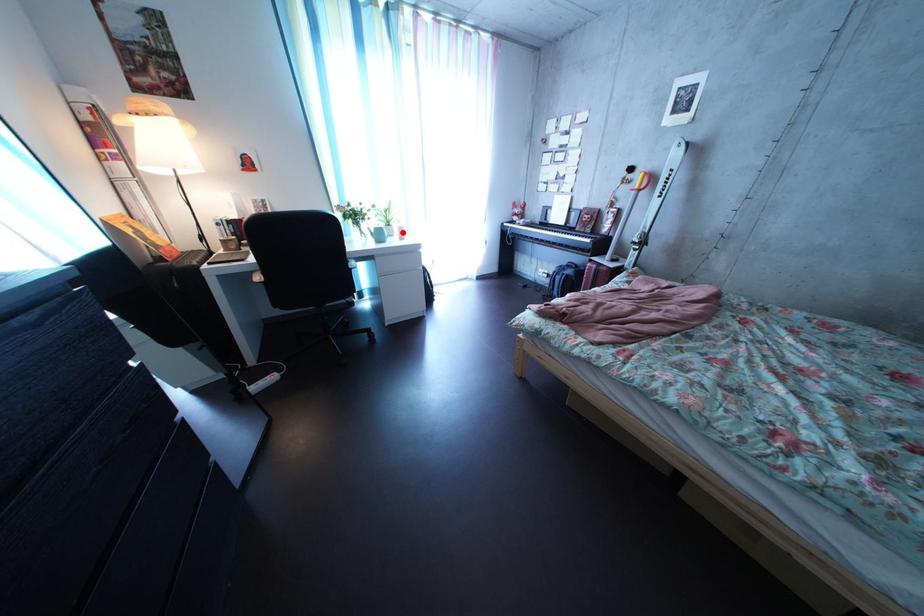
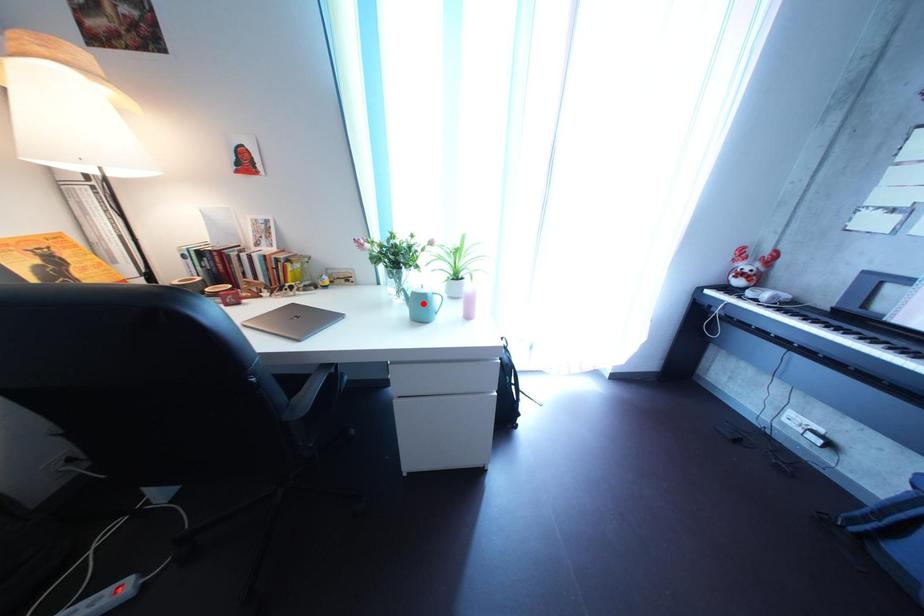
I am providing you with two images of the same scene from different viewpoints. A red point is marked on the first image and another point is marked on the second image. Does the point marked in image1 correspond to the same location as the one in image2?

No